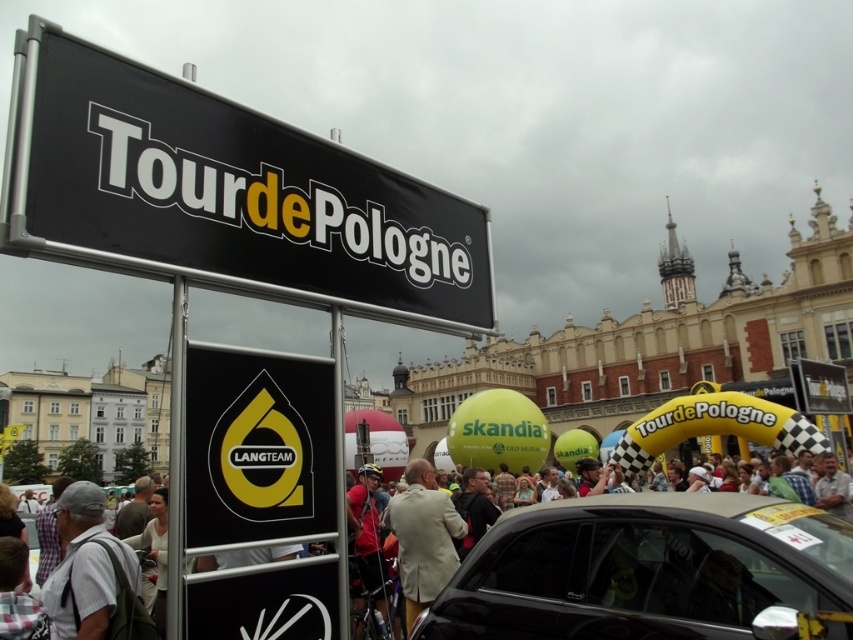
Question: Estimate the real-world distances between objects in this image. Which object is closer to the black glossy car at center?

Choices:
 (A) gray fabric shirt at lower left
 (B) black matte sign at upper left
 (C) white cotton shirt at center

Answer: (C)

Question: Which object appears farthest from the camera in this image?

Choices:
 (A) black glossy car at center
 (B) black matte sign at upper left

Answer: (A)

Question: Is the position of white cotton shirt at center more distant than that of black glossy car at center?

Choices:
 (A) yes
 (B) no

Answer: (B)

Question: Is yellow matte sign at center thinner than light beige suit at center?

Choices:
 (A) no
 (B) yes

Answer: (B)

Question: Is the position of black matte sign at upper left less distant than that of black glossy car at center?

Choices:
 (A) no
 (B) yes

Answer: (B)

Question: Among these points, which one is farthest from the camera?

Choices:
 (A) (54, 579)
 (B) (489, 548)

Answer: (B)